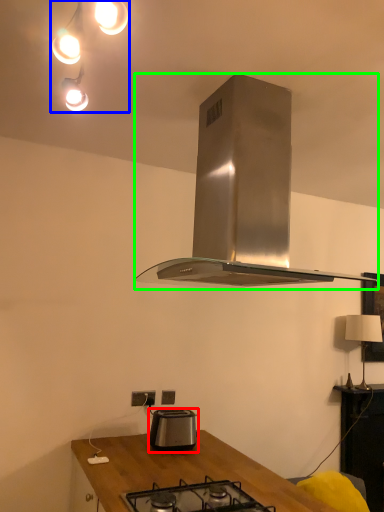
Question: Based on their relative distances, which object is nearer to toaster (highlighted by a red box)? Choose from light fixture (highlighted by a blue box) and kitchen appliance (highlighted by a green box).

Choices:
 (A) light fixture
 (B) kitchen appliance

Answer: (B)